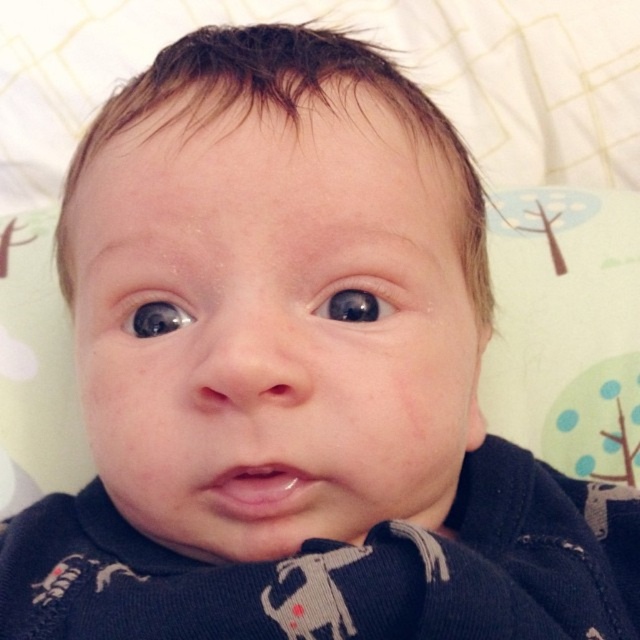
Question: Can you confirm if black glossy eye at center is wider than black glossy eye at upper left?

Choices:
 (A) yes
 (B) no

Answer: (A)

Question: Observing the image, what is the correct spatial positioning of black glossy eye at center in reference to black glossy eye at upper left?

Choices:
 (A) left
 (B) right

Answer: (B)

Question: Which object is farther from the camera taking this photo?

Choices:
 (A) black glossy eye at upper left
 (B) black glossy eye at center

Answer: (A)

Question: Does black glossy eye at center appear under black glossy eye at upper left?

Choices:
 (A) yes
 (B) no

Answer: (B)

Question: Which object is closer to the camera taking this photo?

Choices:
 (A) black glossy eye at center
 (B) black glossy eye at upper left

Answer: (A)